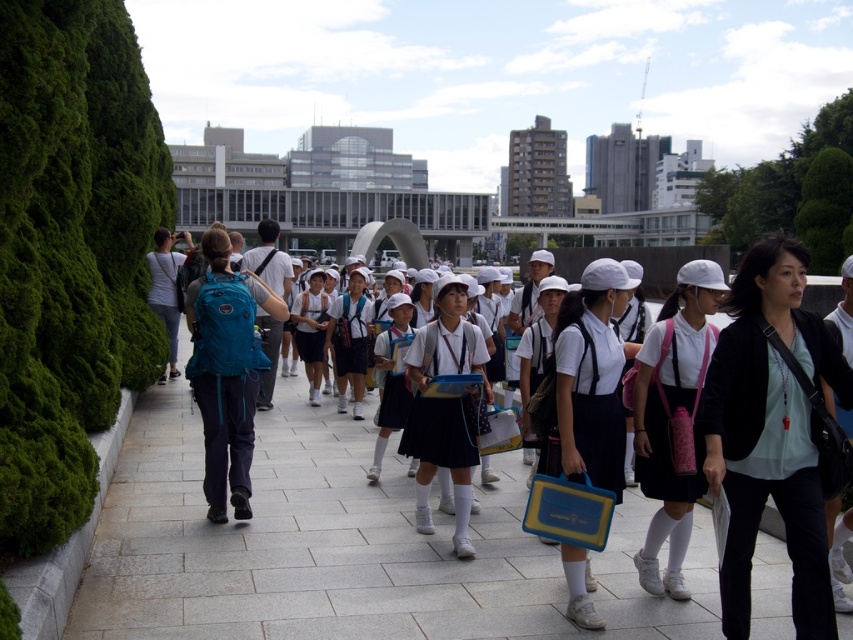
You are a photographer positioned at the center of the pathway. You want to capture a photo of the black matte jacket at right. Based on the coordinates provided, in which direction should you move to get the best shot?

The black matte jacket at right is located at point 0.675 on the x and 0.905 on the y coordinate. Since you are at the center, you should move to the right and slightly forward to align with the jacket.